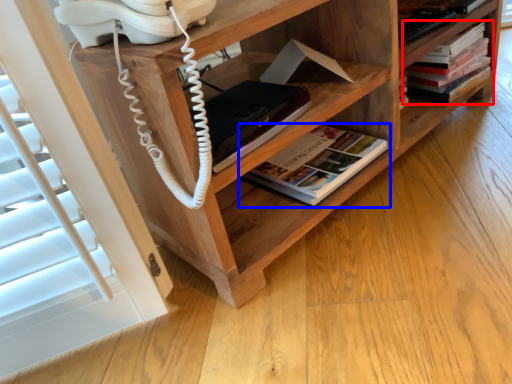
Question: Among these objects, which one is nearest to the camera, book (highlighted by a red box) or book (highlighted by a blue box)?

Choices:
 (A) book
 (B) book

Answer: (B)